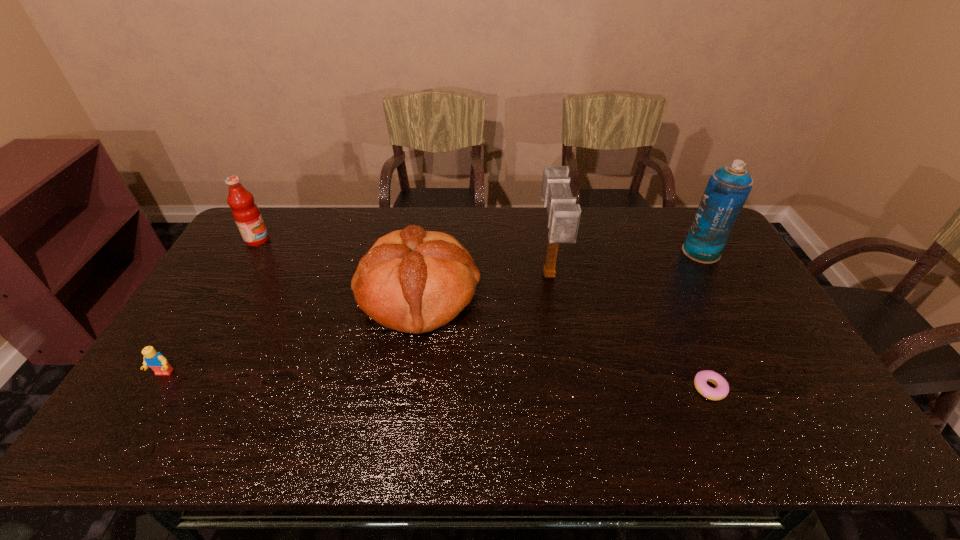
The image size is (960, 540). I want to click on vacant area between the bread and the shortest object, so click(x=564, y=341).

Locate an element on the screen. unoccupied position between the third shortest object and the fruit juice is located at coordinates (338, 267).

At what (x,y) coordinates should I click in order to perform the action: click on unoccupied position between the second shortest object and the fourth object from right to left. Please return your answer as a coordinate pair (x, y). Looking at the image, I should click on (291, 333).

Identify the location of free spot between the fourth tallest object and the fruit juice. This screenshot has width=960, height=540. (338, 267).

At what (x,y) coordinates should I click in order to perform the action: click on empty location between the shortest object and the rightmost object. Please return your answer as a coordinate pair (x, y). Image resolution: width=960 pixels, height=540 pixels. Looking at the image, I should click on (706, 320).

I want to click on the second closest object to the mallet, so click(x=721, y=391).

Locate which object is the second closest to the rightmost object. Please provide its 2D coordinates. Your answer should be formatted as a tuple, i.e. [(x, y)], where the tuple contains the x and y coordinates of a point satisfying the conditions above.

[(721, 391)]

You are a GUI agent. You are given a task and a screenshot of the screen. Output one action in this format:
    pyautogui.click(x=<x>, y=<y>)
    Task: Click on the free region that satisfies the following two spatial constraints: 1. on the back side of the shortest object; 2. on the front label of the fourth shortest object
    The height and width of the screenshot is (540, 960).
    Given the screenshot: What is the action you would take?
    pyautogui.click(x=645, y=240)

This screenshot has height=540, width=960. I want to click on free space that satisfies the following two spatial constraints: 1. on the front-facing side of the Lego; 2. on the right side of the fifth object from left to right, so click(x=155, y=389).

Image resolution: width=960 pixels, height=540 pixels. What are the coordinates of `free point that satisfies the following two spatial constraints: 1. on the front label of the fruit juice; 2. on the right side of the third shortest object` in the screenshot? It's located at (226, 293).